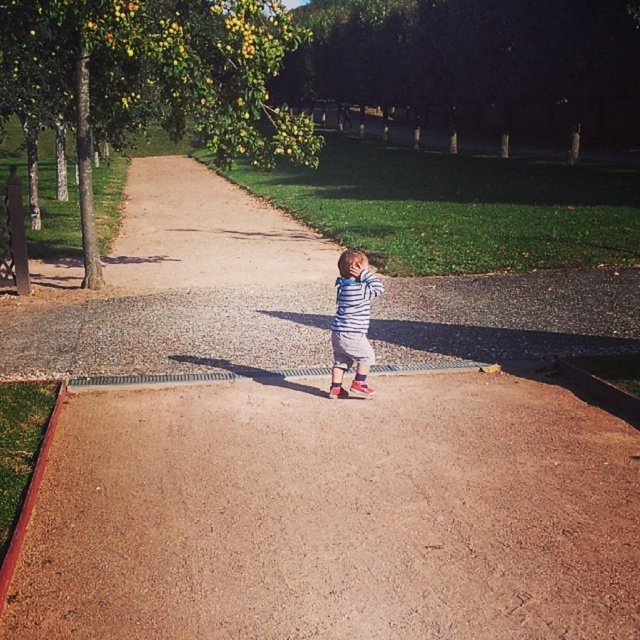
Question: Can you confirm if brown gravel dirt track at center is positioned below striped cotton shirt at center?

Choices:
 (A) yes
 (B) no

Answer: (A)

Question: Which of the following is the closest to the observer?

Choices:
 (A) brown gravel path at center
 (B) striped cotton shirt at center

Answer: (B)

Question: Estimate the real-world distances between objects in this image. Which object is farther from the brown gravel path at center?

Choices:
 (A) brown gravel dirt track at center
 (B) striped cotton shirt at center

Answer: (A)

Question: Does brown gravel dirt track at center appear under brown gravel path at center?

Choices:
 (A) yes
 (B) no

Answer: (A)

Question: Which point appears farthest from the camera in this image?

Choices:
 (A) (218, 214)
 (B) (104, 609)

Answer: (A)

Question: Can you confirm if brown gravel path at center is positioned to the right of striped cotton shirt at center?

Choices:
 (A) no
 (B) yes

Answer: (A)